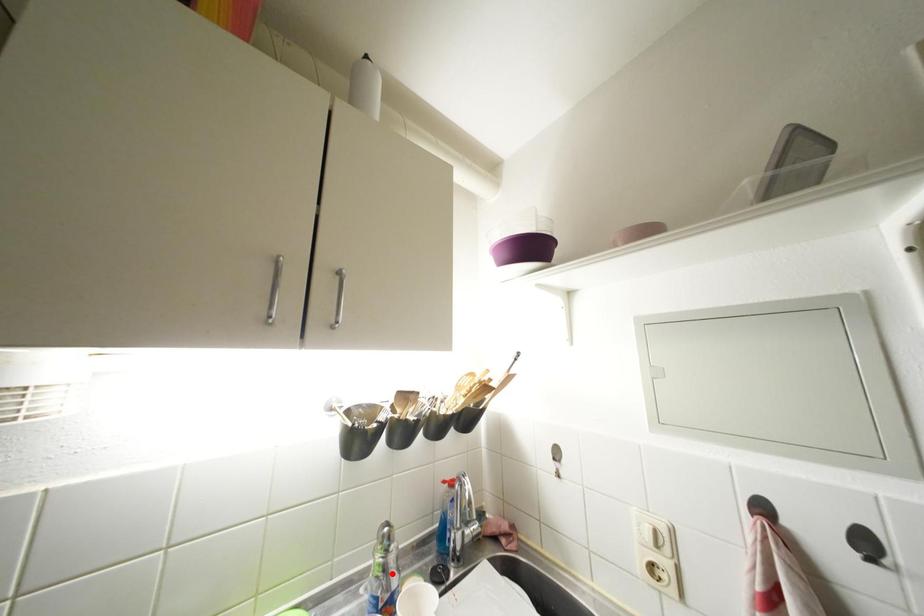
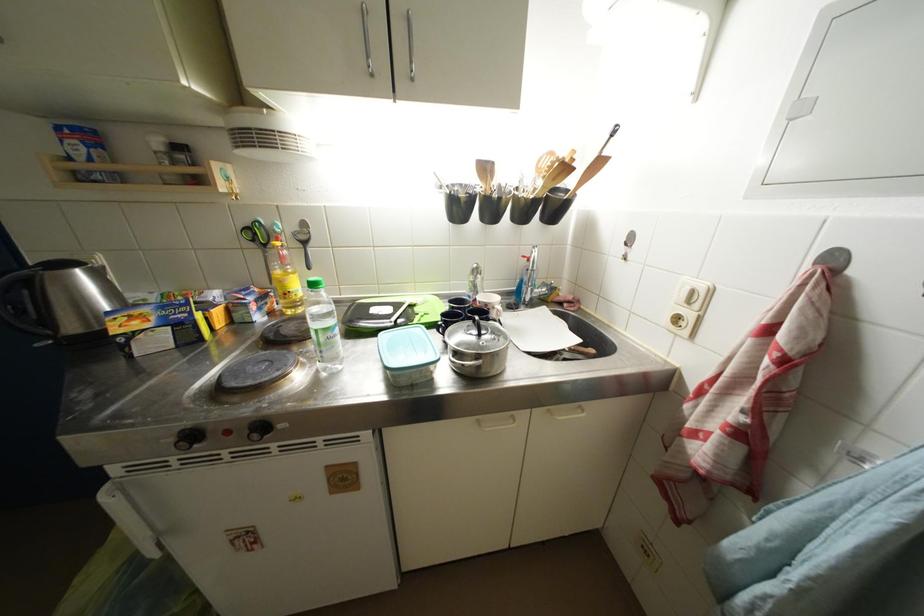
In the second image, find the point that corresponds to the highlighted location in the first image.

(481, 291)